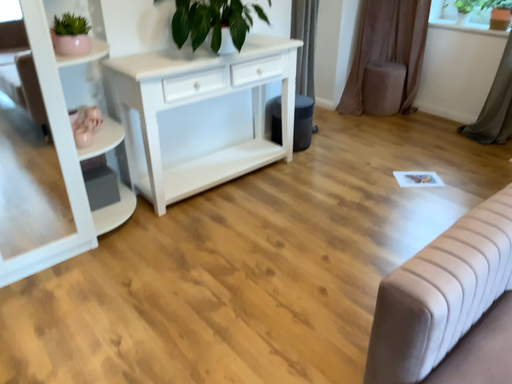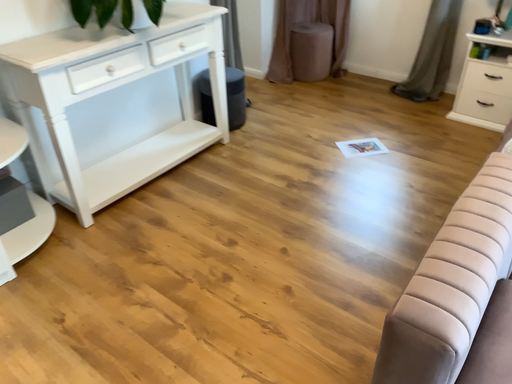
Question: How did the camera likely rotate when shooting the video?

Choices:
 (A) rotated left
 (B) rotated right

Answer: (B)